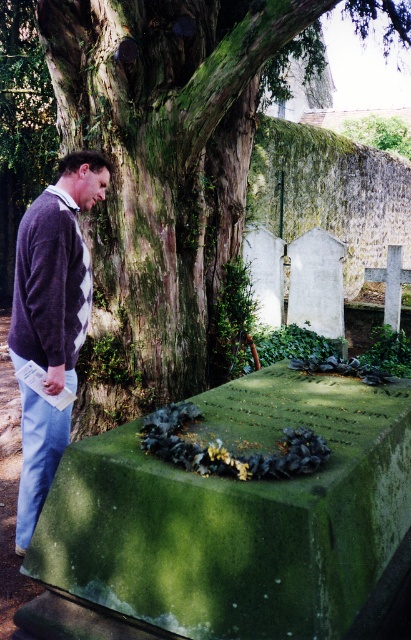
Question: Does green mossy stone at center lie behind dark purple argyle sweater at left?

Choices:
 (A) yes
 (B) no

Answer: (B)

Question: Does green mossy tree trunk at upper left appear over dark purple argyle sweater at left?

Choices:
 (A) yes
 (B) no

Answer: (A)

Question: Which of the following is the closest to the observer?

Choices:
 (A) (307, 541)
 (B) (36, 228)
 (C) (73, 177)

Answer: (A)

Question: Does green mossy tree trunk at upper left have a larger size compared to dark purple sweater at left?

Choices:
 (A) yes
 (B) no

Answer: (A)

Question: Which object appears closest to the camera in this image?

Choices:
 (A) dark purple sweater at left
 (B) green mossy stone at center

Answer: (B)

Question: Which point appears farthest from the camera in this image?

Choices:
 (A) (394, 392)
 (B) (62, 276)
 (C) (22, 330)
 (D) (170, 369)

Answer: (D)